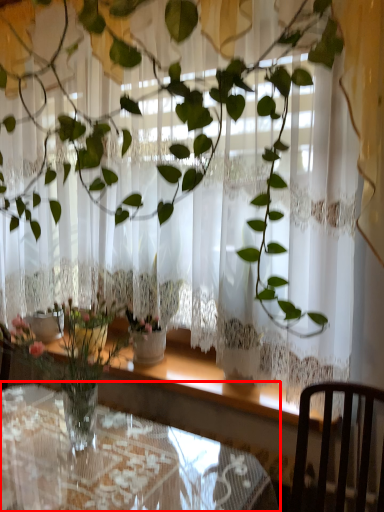
Question: Where is table (annotated by the red box) located in relation to chair in the image?

Choices:
 (A) left
 (B) right

Answer: (A)